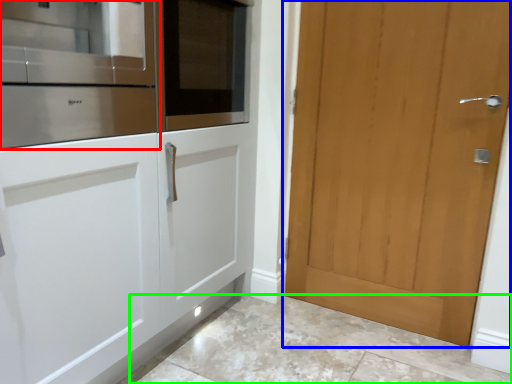
Question: Based on their relative distances, which object is nearer to cabinetry (highlighted by a red box)? Choose from door (highlighted by a blue box) and granite (highlighted by a green box).

Choices:
 (A) door
 (B) granite

Answer: (A)